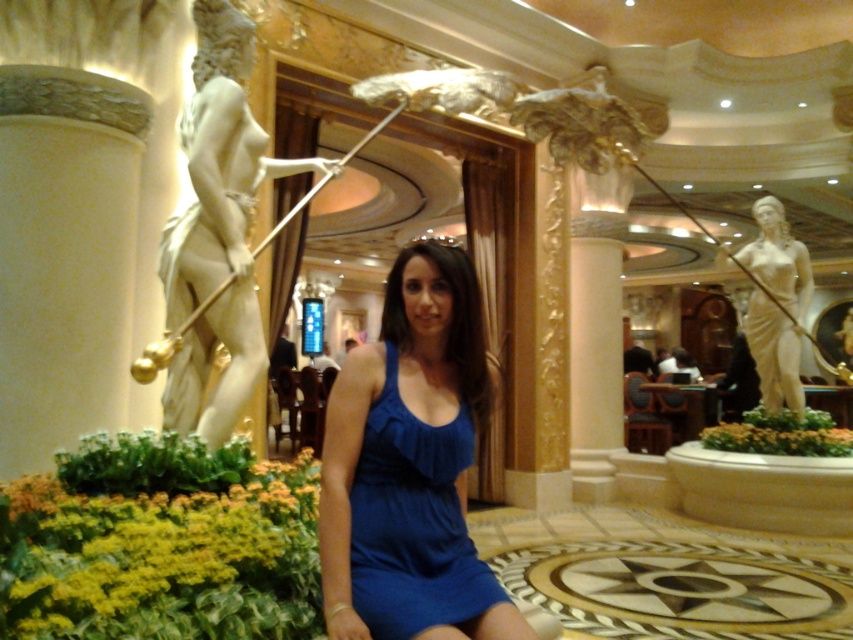
Question: Does matte blue dress at center come in front of white marble statue at right?

Choices:
 (A) yes
 (B) no

Answer: (A)

Question: Does white marble statue at left appear under white marble statue at right?

Choices:
 (A) yes
 (B) no

Answer: (B)

Question: Among these objects, which one is nearest to the camera?

Choices:
 (A) white marble statue at left
 (B) matte blue dress at center

Answer: (B)

Question: Estimate the real-world distances between objects in this image. Which object is farther from the white marble statue at left?

Choices:
 (A) matte blue dress at center
 (B) white marble statue at right

Answer: (B)

Question: Does white marble statue at left have a smaller size compared to matte blue dress at center?

Choices:
 (A) yes
 (B) no

Answer: (B)

Question: Based on their relative distances, which object is farther from the white marble statue at right?

Choices:
 (A) matte blue dress at center
 (B) white marble statue at left

Answer: (A)